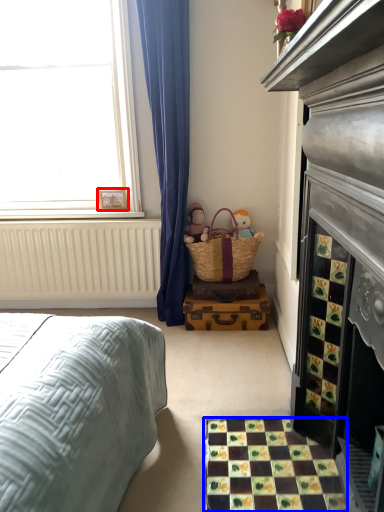
Question: Which object appears closest to the camera in this image, picture frame (highlighted by a red box) or tile (highlighted by a blue box)?

Choices:
 (A) picture frame
 (B) tile

Answer: (B)